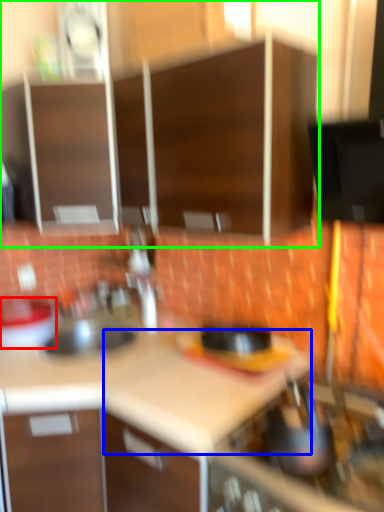
Question: Which object is the closest to the kitchen appliance (highlighted by a red box)? Choose among these: counter top (highlighted by a blue box) or cabinetry (highlighted by a green box).

Choices:
 (A) counter top
 (B) cabinetry

Answer: (A)